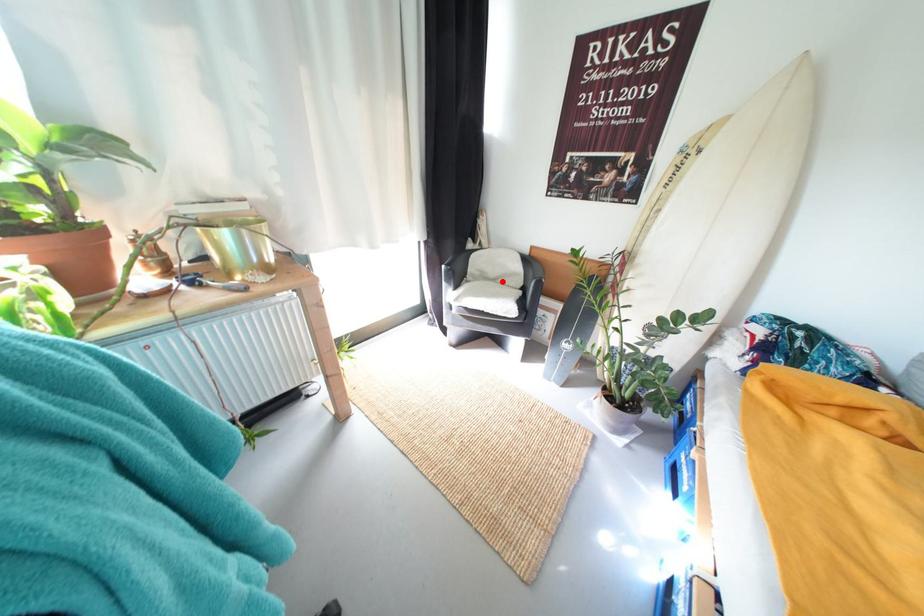
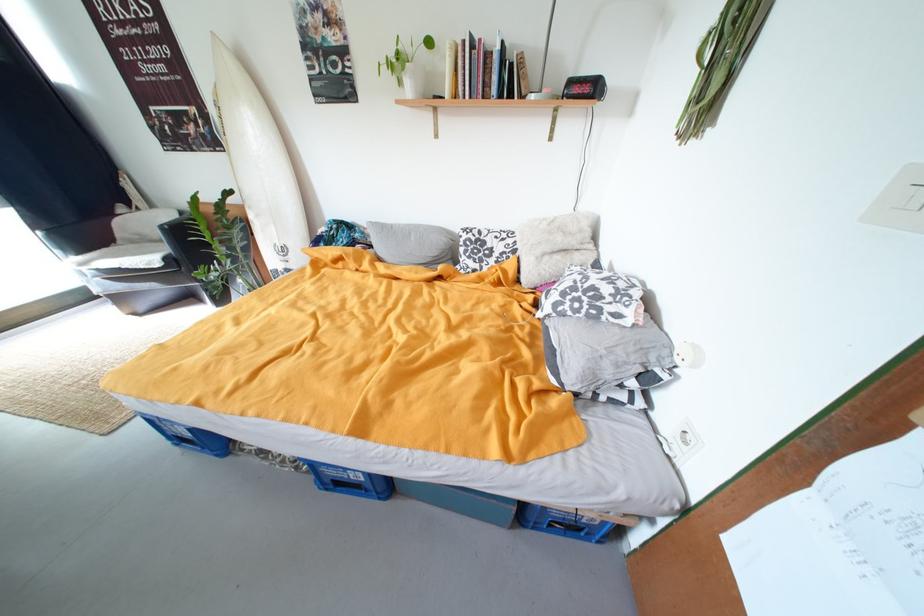
Find the pixel in the second image that matches the highlighted location in the first image.

(169, 243)